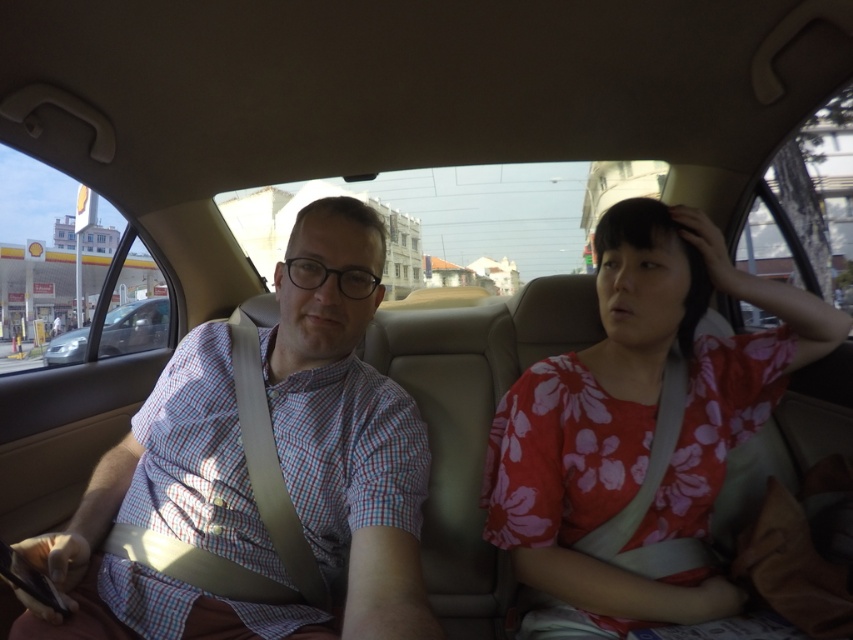
Question: Among these points, which one is farthest from the camera?

Choices:
 (A) (177, 435)
 (B) (112, 314)

Answer: (B)

Question: Observing the image, what is the correct spatial positioning of floral cotton shirt at right in reference to metallic silver sedan at left?

Choices:
 (A) right
 (B) left

Answer: (A)

Question: Can you confirm if checkered fabric shirt at left is thinner than floral cotton shirt at right?

Choices:
 (A) yes
 (B) no

Answer: (A)

Question: Estimate the real-world distances between objects in this image. Which object is farther from the checkered fabric shirt at left?

Choices:
 (A) metallic silver sedan at left
 (B) floral cotton shirt at right

Answer: (A)

Question: Which object appears closest to the camera in this image?

Choices:
 (A) metallic silver sedan at left
 (B) floral cotton shirt at right

Answer: (B)

Question: Does checkered fabric shirt at left appear under metallic silver sedan at left?

Choices:
 (A) no
 (B) yes

Answer: (B)